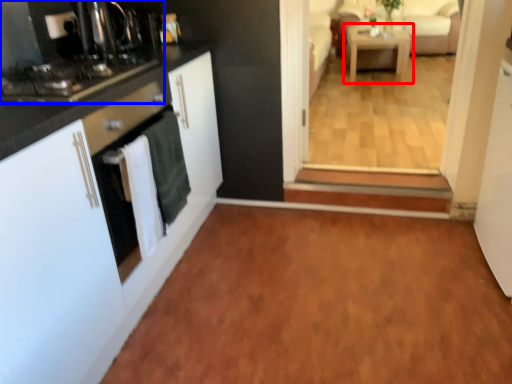
Question: Which object is closer to the camera taking this photo, table (highlighted by a red box) or home appliance (highlighted by a blue box)?

Choices:
 (A) table
 (B) home appliance

Answer: (B)